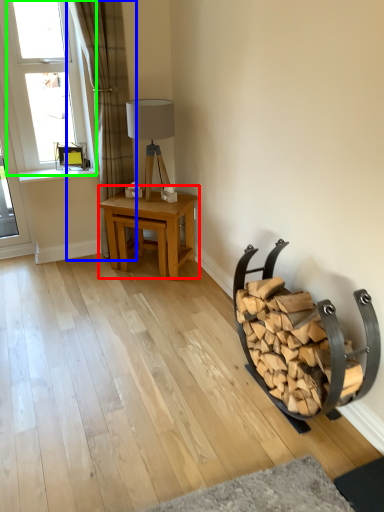
Question: Which object is the farthest from table (highlighted by a red box)? Choose among these: curtain (highlighted by a blue box) or window (highlighted by a green box).

Choices:
 (A) curtain
 (B) window

Answer: (B)